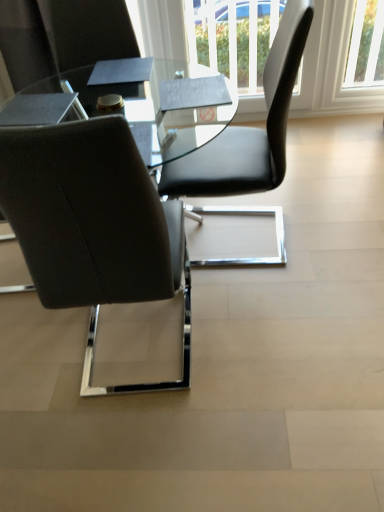
Locate an element on the screen. The image size is (384, 512). free space in front of transparent glass table at center is located at coordinates (176, 408).